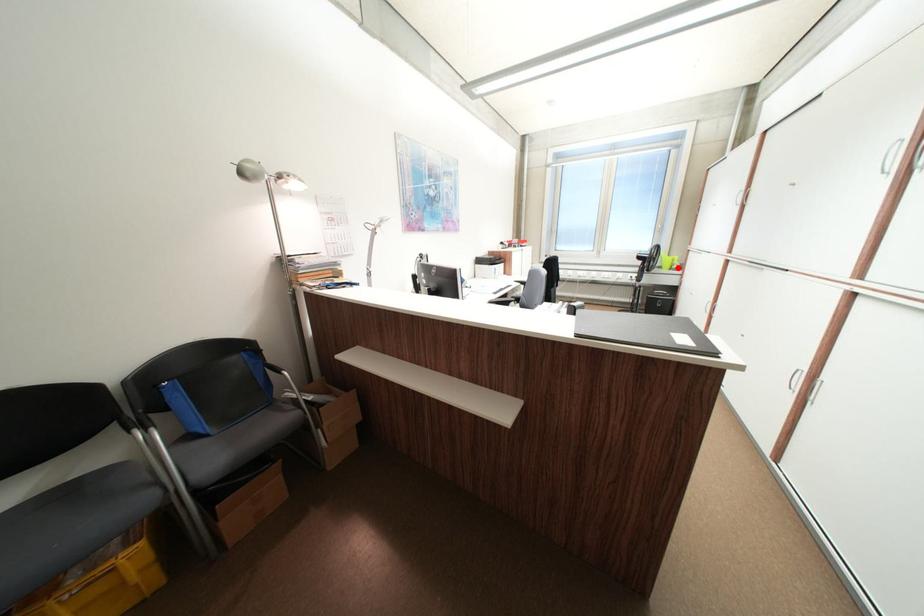
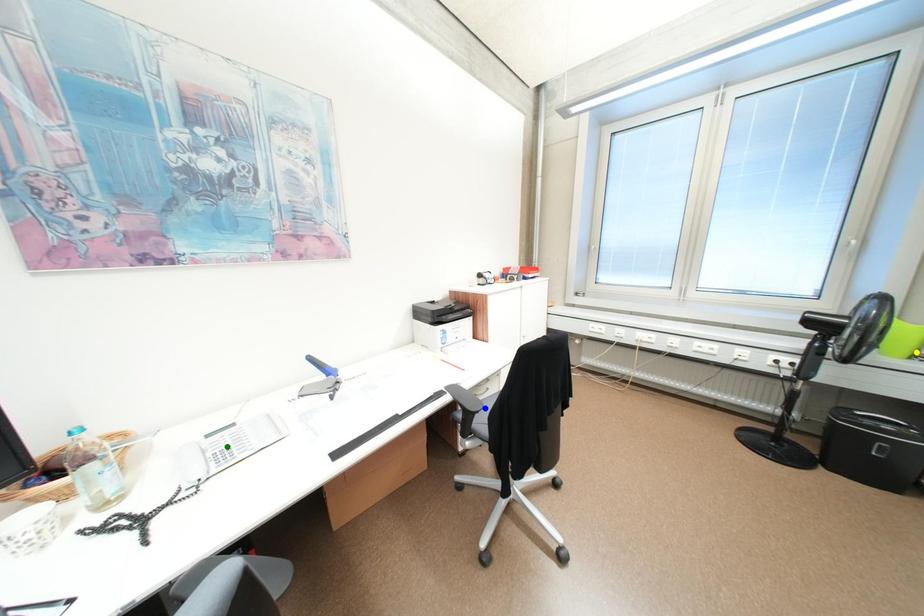
Question: I am providing you with two images of the same scene from different viewpoints. A red point is marked on the first image. You are given multiple points on the second image. Which point in image 2 is actually the same real-world point as the red point in image 1?

Choices:
 (A) green point
 (B) yellow point
 (C) blue point

Answer: (B)